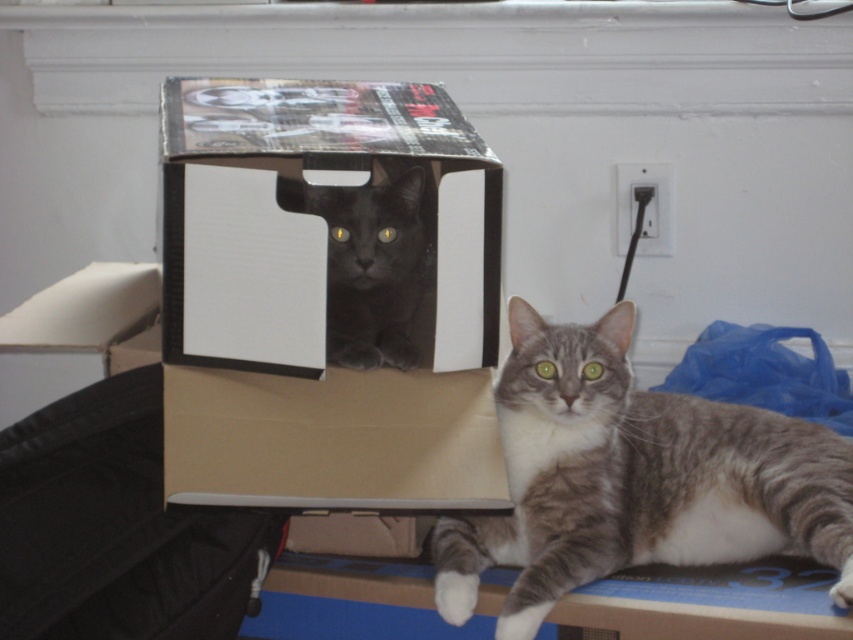
You are trying to decide if the shiny black cat at center can fit inside the matte cardboard box at upper center. Based on their sizes, what do you think?

The matte cardboard box at upper center is bigger than the shiny black cat at center, so the shiny black cat at center can fit inside the matte cardboard box at upper center.

You are trying to decide whether the gray tabby cat at center can fit inside the matte cardboard box at upper center. Based on their sizes, what do you think?

The gray tabby cat at center might be wider than matte cardboard box at upper center, so it may not fit inside.

You are trying to decide which cardboard box to use for storing your cat toys. The cardboard box at center and the matte cardboard box at upper center are both available. Based on their sizes, which one can hold more items?

The cardboard box at center is larger in size than the matte cardboard box at upper center, so it can hold more items.